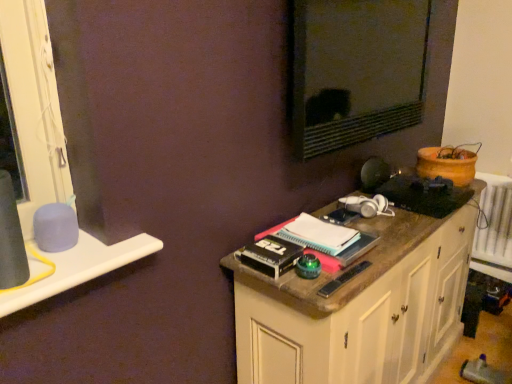
The image size is (512, 384). Describe the element at coordinates (360, 306) in the screenshot. I see `wooden cabinet at right` at that location.

Where is `matte black mirror at upper center`? Image resolution: width=512 pixels, height=384 pixels. matte black mirror at upper center is located at coordinates (356, 70).

In the scene shown: In order to face matte black mirror at upper center, should I rotate leftwards or rightwards?

Rotate right and turn 15.537 degrees.

This screenshot has height=384, width=512. Find the location of `wooden cabinet at right`. wooden cabinet at right is located at coordinates (360, 306).

From the image's perspective, is wooden cabinet at right under matte black mirror at upper center?

Yes, from the image's perspective, wooden cabinet at right is below matte black mirror at upper center.

In the scene shown: From a real-world perspective, which is physically above, wooden cabinet at right or matte black mirror at upper center?

matte black mirror at upper center.

Can you tell me how much wooden cabinet at right and matte black mirror at upper center differ in facing direction?

The facing directions of wooden cabinet at right and matte black mirror at upper center are 1.11 degrees apart.

Is wooden cabinet at right far away from matte black mirror at upper center?

That's not correct — wooden cabinet at right is a little close to matte black mirror at upper center.

Consider the image. Considering the relative positions of white plastic window sill at left and wooden cabinet at right in the image provided, is white plastic window sill at left to the left or to the right of wooden cabinet at right?

white plastic window sill at left is positioned on wooden cabinet at right's left side.

Is the position of white plastic window sill at left less distant than that of wooden cabinet at right?

Yes, it is.

From a real-world perspective, is white plastic window sill at left positioned above or below wooden cabinet at right?

white plastic window sill at left is situated higher than wooden cabinet at right in the real world.

Could you tell me if white plastic window sill at left is turned towards wooden cabinet at right?

No, white plastic window sill at left is not turned towards wooden cabinet at right.

Looking at this image, can you confirm if wooden cabinet at right is shorter than white plastic window sill at left?

No.

Is wooden cabinet at right oriented away from white plastic window sill at left?

No, wooden cabinet at right is not facing the opposite direction of white plastic window sill at left.

Can you confirm if wooden cabinet at right is smaller than white plastic window sill at left?

Actually, wooden cabinet at right might be larger than white plastic window sill at left.

Does point (137, 243) come farther from viewer compared to point (405, 83)?

No, it is in front of (405, 83).

Which object is positioned more to the left, white plastic window sill at left or matte black mirror at upper center?

white plastic window sill at left is more to the left.

Does white plastic window sill at left have a greater width compared to matte black mirror at upper center?

Yes.

Between white plastic window sill at left and matte black mirror at upper center, which one has smaller size?

white plastic window sill at left.

Does matte black mirror at upper center have a lesser width compared to white plastic window sill at left?

Indeed, matte black mirror at upper center has a lesser width compared to white plastic window sill at left.

In the scene shown: Can you tell me how much matte black mirror at upper center and white plastic window sill at left differ in facing direction?

0.369 degrees.

Is matte black mirror at upper center facing away from white plastic window sill at left?

No, white plastic window sill at left is not at the back of matte black mirror at upper center.

How much distance is there between matte black mirror at upper center and wooden cabinet at right?

The distance of matte black mirror at upper center from wooden cabinet at right is 23.02 inches.

Can you confirm if matte black mirror at upper center is bigger than wooden cabinet at right?

No.

Identify the location of cabinetry beneath the matte black mirror at upper center (from a real-world perspective). The height and width of the screenshot is (384, 512). (360, 306).

Choose the correct answer: Is matte black mirror at upper center inside wooden cabinet at right or outside it?

matte black mirror at upper center is spatially situated outside wooden cabinet at right.

In order to click on wide located behind the wooden cabinet at right in this screenshot , I will do `click(356, 70)`.

Locate an element on the screen. This screenshot has height=384, width=512. window sill in front of the wooden cabinet at right is located at coordinates (75, 267).

Looking at this image, based on their spatial positions, is matte black mirror at upper center or white plastic window sill at left closer to wooden cabinet at right?

Based on the image, matte black mirror at upper center appears to be nearer to wooden cabinet at right.

When comparing their distances from white plastic window sill at left, does wooden cabinet at right or matte black mirror at upper center seem further?

Based on the image, matte black mirror at upper center appears to be further to white plastic window sill at left.

Looking at the image, which one is located further to wooden cabinet at right, white plastic window sill at left or matte black mirror at upper center?

white plastic window sill at left.

Which object lies nearer to the anchor point matte black mirror at upper center, wooden cabinet at right or white plastic window sill at left?

wooden cabinet at right is closer to matte black mirror at upper center.

Looking at the image, which one is located closer to white plastic window sill at left, matte black mirror at upper center or wooden cabinet at right?

wooden cabinet at right lies closer to white plastic window sill at left than the other object.

In the scene shown: Estimate the real-world distances between objects in this image. Which object is further from matte black mirror at upper center, white plastic window sill at left or wooden cabinet at right?

white plastic window sill at left is positioned further to the anchor matte black mirror at upper center.

This screenshot has height=384, width=512. I want to click on wide situated between white plastic window sill at left and wooden cabinet at right from left to right, so click(x=356, y=70).